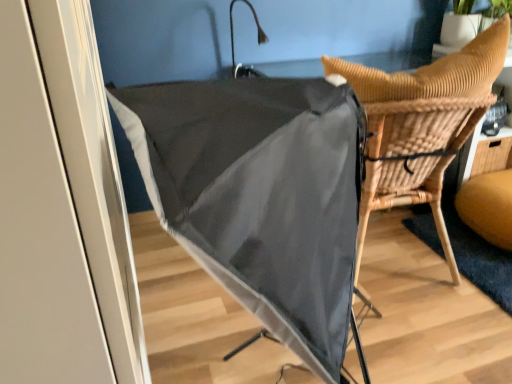
Question: In terms of width, does woven wood chair at center look wider or thinner when compared to woven wood table at right?

Choices:
 (A) thin
 (B) wide

Answer: (B)

Question: Is point (497, 39) closer or farther from the camera than point (460, 165)?

Choices:
 (A) farther
 (B) closer

Answer: (B)

Question: Which object is positioned closest to the woven wood table at right?

Choices:
 (A) matte black umbrella at center
 (B) woven wood chair at center

Answer: (B)

Question: Which of these objects is positioned farthest from the woven wood table at right?

Choices:
 (A) woven wood chair at center
 (B) matte black umbrella at center

Answer: (B)